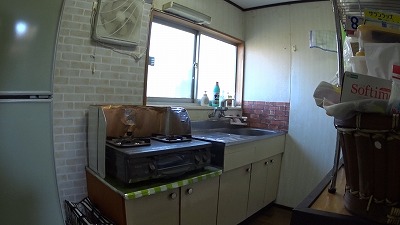
The image size is (400, 225). In order to click on silver wire rack in this screenshot , I will do `click(336, 6)`.